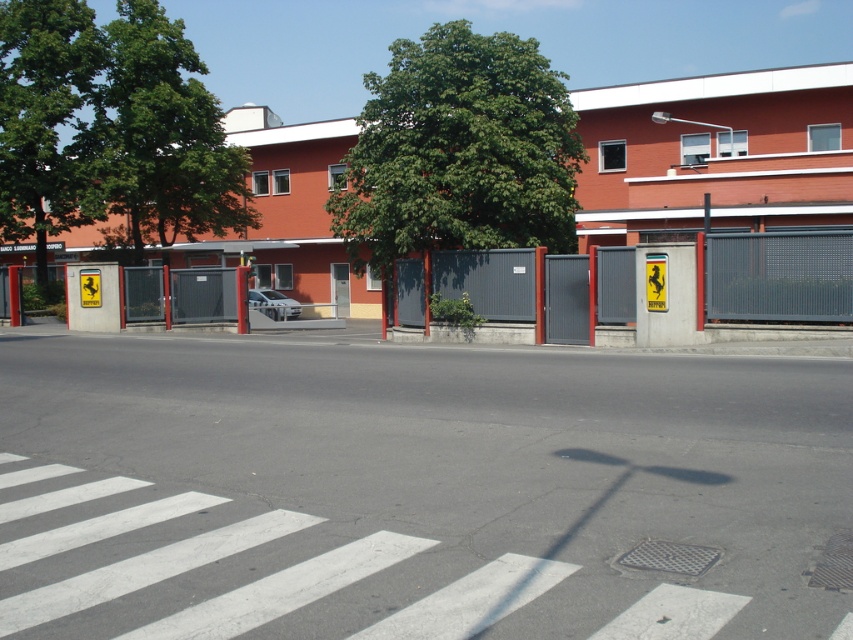
Question: Estimate the real-world distances between objects in this image. Which object is closer to the metallic pole at center?

Choices:
 (A) white asphalt at center
 (B) green leafy tree at upper left

Answer: (A)

Question: Does green leafy tree at upper left have a lesser width compared to white glossy car at center?

Choices:
 (A) no
 (B) yes

Answer: (A)

Question: Which object appears closest to the camera in this image?

Choices:
 (A) green leafy tree at center
 (B) white glossy car at center
 (C) green leafy tree at upper center

Answer: (A)

Question: Which point is closer to the camera taking this photo?

Choices:
 (A) (41, 282)
 (B) (254, 305)
 (C) (660, 620)

Answer: (C)

Question: Can you confirm if white asphalt at center is wider than green leafy tree at center?

Choices:
 (A) no
 (B) yes

Answer: (A)

Question: From the image, what is the correct spatial relationship of green leafy tree at upper center in relation to metallic pole at center?

Choices:
 (A) left
 (B) right

Answer: (A)